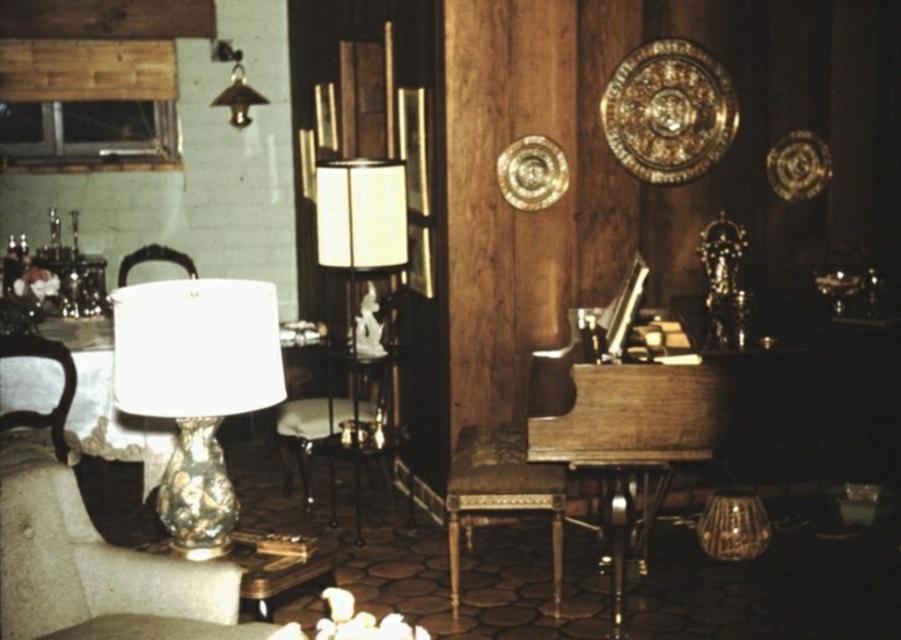
You are standing in the vintage living room and want to move from the gold metallic lampshade at upper left to the metallic gold chair at left. Which direction should you move to reach the chair?

The gold metallic lampshade at upper left is to the right of the metallic gold chair at left, so you should move to the left to reach the chair.